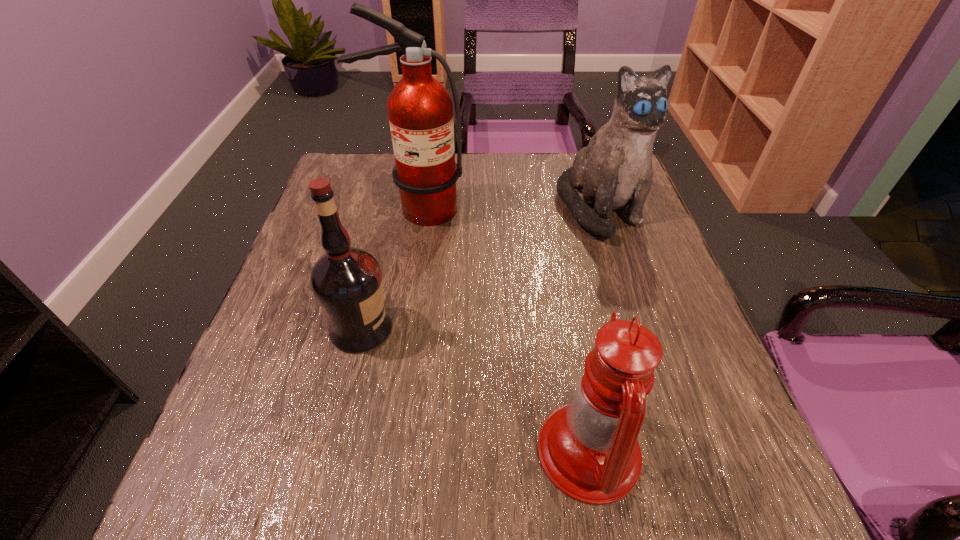
This screenshot has width=960, height=540. Identify the location of vacant space that is in between the liquor and the cat. (480, 268).

Locate which object is the second closest to the oil lamp. Please provide its 2D coordinates. Your answer should be formatted as a tuple, i.e. [(x, y)], where the tuple contains the x and y coordinates of a point satisfying the conditions above.

[(615, 170)]

What are the coordinates of `the second closest object to the tallest object` in the screenshot? It's located at (347, 283).

Find the location of a particular element. This screenshot has height=540, width=960. free space that satisfies the following two spatial constraints: 1. at the face of the cat; 2. on the surface of the second nearest object is located at coordinates (637, 328).

Locate an element on the screen. This screenshot has height=540, width=960. free space that satisfies the following two spatial constraints: 1. at the face of the cat; 2. on the surface of the liquor is located at coordinates (637, 328).

Where is `vacant space that satisfies the following two spatial constraints: 1. on the surface of the nearest object; 2. on the left side of the liquor`? This screenshot has height=540, width=960. vacant space that satisfies the following two spatial constraints: 1. on the surface of the nearest object; 2. on the left side of the liquor is located at coordinates (332, 451).

Locate an element on the screen. Image resolution: width=960 pixels, height=540 pixels. vacant space that satisfies the following two spatial constraints: 1. on the surface of the oil lamp; 2. on the left side of the liquor is located at coordinates (332, 451).

Locate an element on the screen. This screenshot has height=540, width=960. blank area in the image that satisfies the following two spatial constraints: 1. on the nozzle and handle of the fire extinguisher; 2. on the surface of the second nearest object is located at coordinates (397, 328).